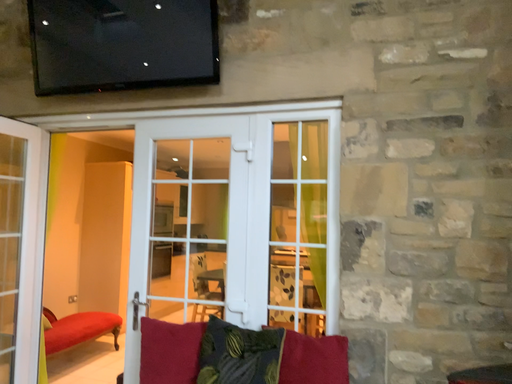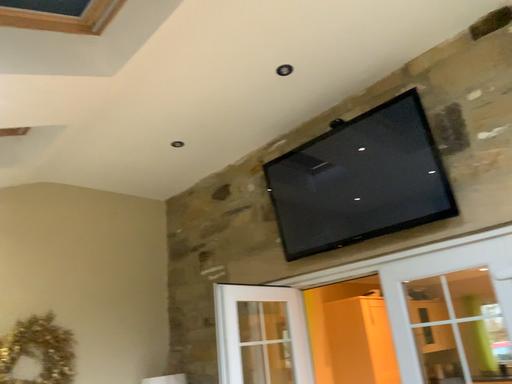
Question: Which way did the camera rotate in the video?

Choices:
 (A) rotated right
 (B) rotated left

Answer: (B)